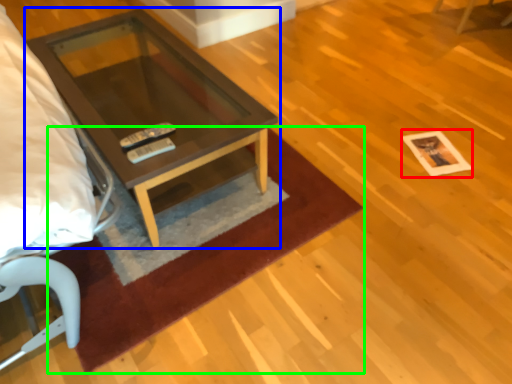
Question: Based on their relative distances, which object is nearer to square (highlighted by a red box)? Choose from coffee table (highlighted by a blue box) and mat (highlighted by a green box).

Choices:
 (A) coffee table
 (B) mat

Answer: (B)